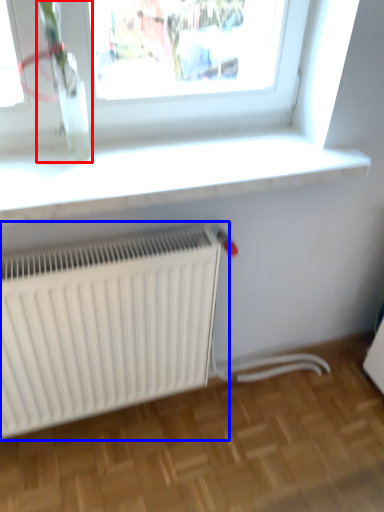
Question: Which object appears farthest to the camera in this image, plant (highlighted by a red box) or radiator (highlighted by a blue box)?

Choices:
 (A) plant
 (B) radiator

Answer: (B)